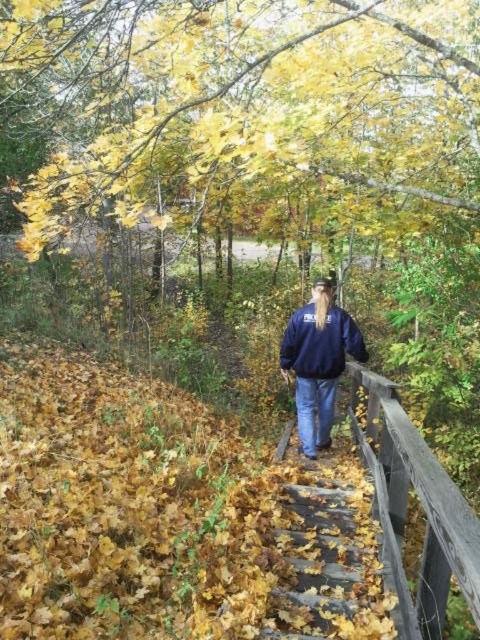
Question: Which point appears farthest from the camera in this image?

Choices:
 (A) (321, 442)
 (B) (385, 518)

Answer: (A)

Question: Is wooden rail at right closer to the viewer compared to navy blue sweatshirt at center?

Choices:
 (A) no
 (B) yes

Answer: (B)

Question: Which object appears closest to the camera in this image?

Choices:
 (A) navy blue sweatshirt at center
 (B) wooden rail at right

Answer: (B)

Question: Can you confirm if wooden rail at right is positioned above navy blue sweatshirt at center?

Choices:
 (A) yes
 (B) no

Answer: (B)

Question: Which point appears farthest from the camera in this image?

Choices:
 (A) (310, 356)
 (B) (417, 477)

Answer: (A)

Question: Can you confirm if wooden rail at right is positioned to the left of navy blue sweatshirt at center?

Choices:
 (A) no
 (B) yes

Answer: (A)